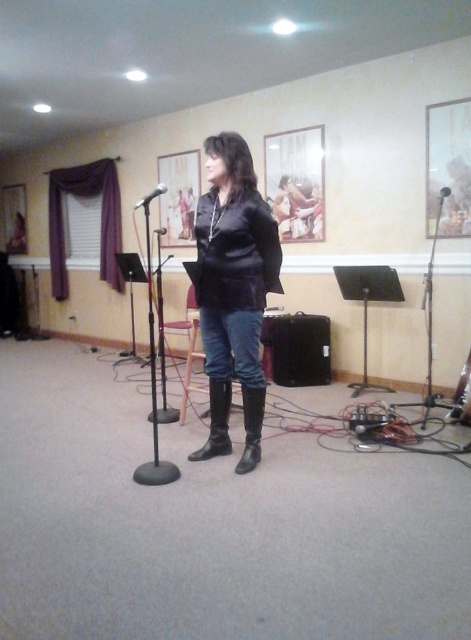
You are a stagehand setting up equipment for a performance. You need to place a 1.2 meter long cable between the metallic silver picture frame at upper center and the metallic silver microphone at center. Will the cable be long enough to reach between them?

The distance between the metallic silver picture frame at upper center and the metallic silver microphone at center is 1.43 meters. The 1.2 meter cable is shorter than the required distance, so it will not be long enough to reach between them.

You are a photographer standing at the camera position. You want to take a photo of the person rehearsing but need to ensure that the matte plastic picture frame at upper center is not in the shot. What should you do?

The matte plastic picture frame at upper center is 5.87 meters away from the camera. To avoid capturing it in the photo, you can adjust your camera angle or position to frame the shot so that the matte plastic picture frame at upper center is out of the frame while keeping the person in focus.